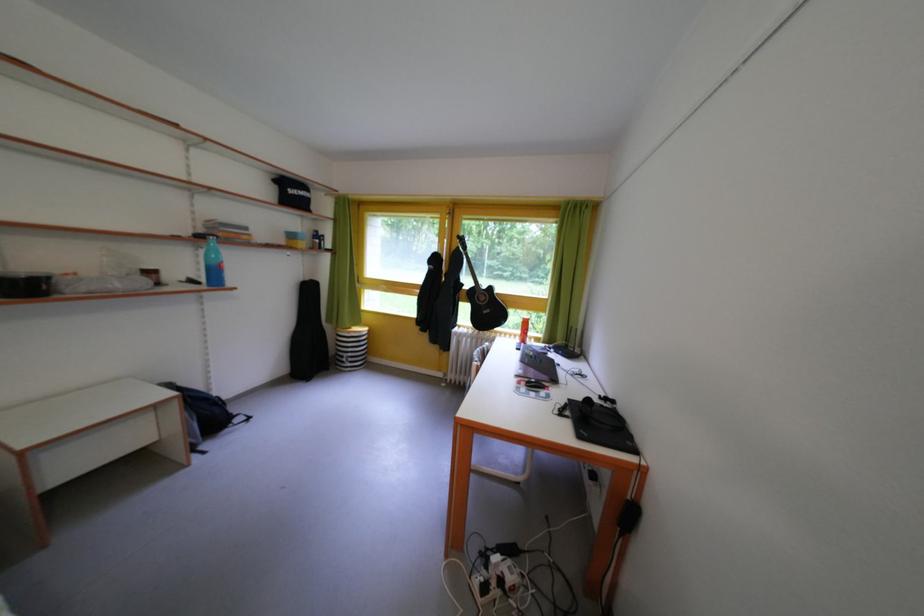
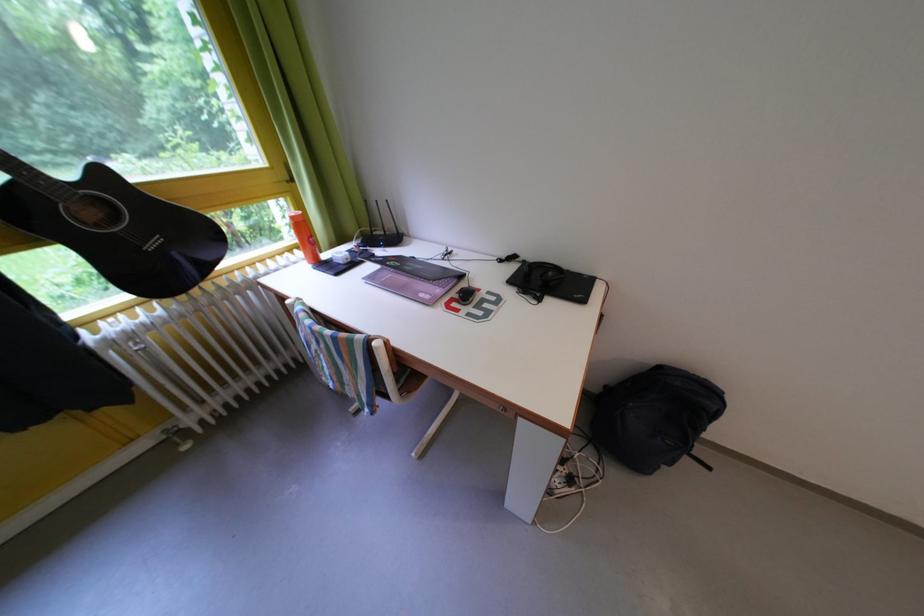
Where in the second image is the point corresponding to (565,367) from the first image?

(417, 261)